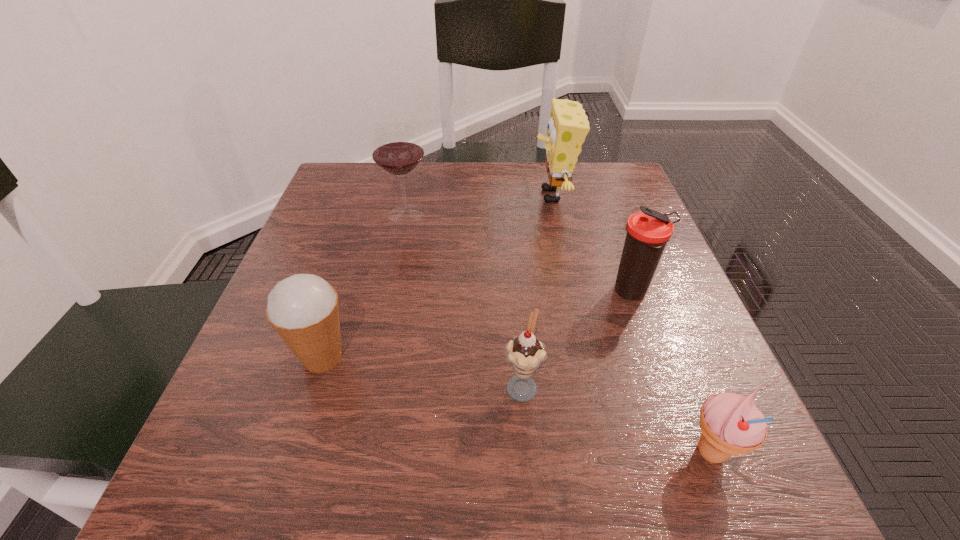
Identify the location of blank space that satisfies the following two spatial constraints: 1. on the face of the sponge; 2. on the right side of the nearest object. The height and width of the screenshot is (540, 960). (609, 453).

Where is `free location that satisfies the following two spatial constraints: 1. on the face of the nearest icecream; 2. on the left side of the sponge`? The width and height of the screenshot is (960, 540). free location that satisfies the following two spatial constraints: 1. on the face of the nearest icecream; 2. on the left side of the sponge is located at coordinates (609, 453).

This screenshot has width=960, height=540. I want to click on free space that satisfies the following two spatial constraints: 1. on the face of the sponge; 2. on the left side of the thermos bottle, so click(573, 292).

Identify the location of free space that satisfies the following two spatial constraints: 1. on the front side of the wineglass; 2. on the right side of the nearest object. (356, 453).

At what (x,y) coordinates should I click in order to perform the action: click on blank space that satisfies the following two spatial constraints: 1. on the back side of the thermos bottle; 2. on the face of the fourth object from left to right. Please return your answer as a coordinate pair (x, y). This screenshot has height=540, width=960. Looking at the image, I should click on pos(597,195).

Identify the location of free space that satisfies the following two spatial constraints: 1. on the front side of the fourth object from right to left; 2. on the left side of the nearest object. click(527, 453).